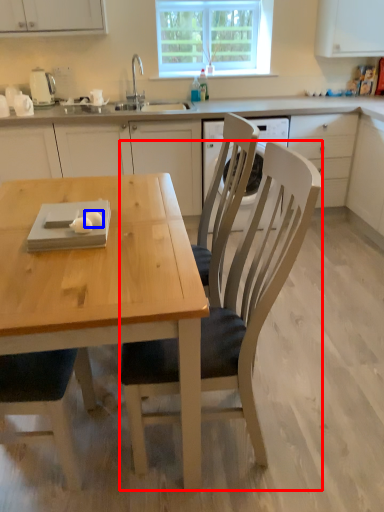
Question: Among these objects, which one is nearest to the camera, chair (highlighted by a red box) or food (highlighted by a blue box)?

Choices:
 (A) chair
 (B) food

Answer: (A)